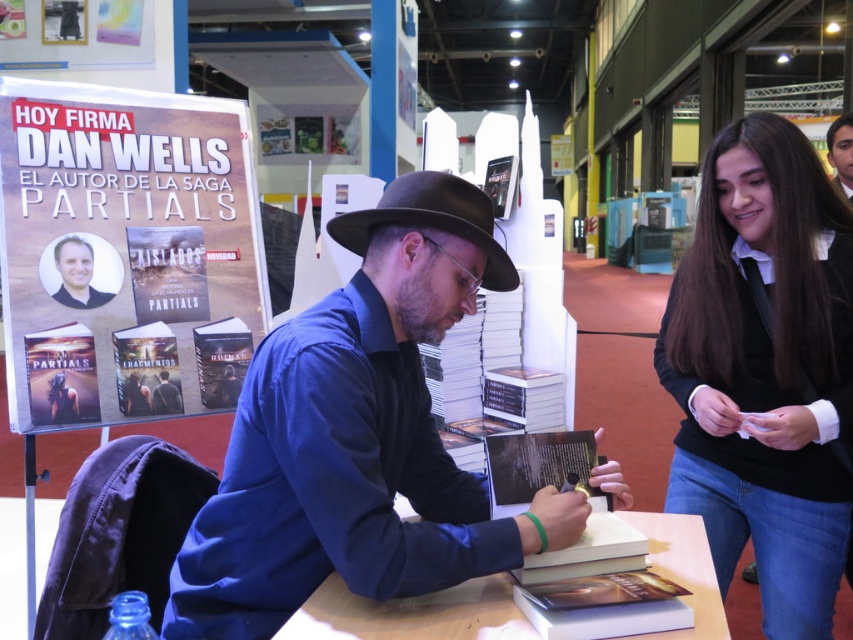
Question: Is blue matte shirt at center further to camera compared to black sweater at center?

Choices:
 (A) yes
 (B) no

Answer: (B)

Question: Which is farther from the black felt fedora at center?

Choices:
 (A) smooth skin face at upper right
 (B) wooden table at center

Answer: (A)

Question: Which point is closer to the camera?

Choices:
 (A) wooden table at center
 (B) matte blue shirt at center
 (C) black felt fedora at center

Answer: (A)

Question: Which point appears farthest from the camera in this image?

Choices:
 (A) (454, 234)
 (B) (677, 376)
 (C) (175, 396)
 (D) (80, 291)

Answer: (C)

Question: From the image, what is the correct spatial relationship of blue matte shirt at center in relation to wooden table at center?

Choices:
 (A) right
 (B) left

Answer: (B)

Question: Is blue matte shirt at center positioned behind black felt fedora at center?

Choices:
 (A) yes
 (B) no

Answer: (B)